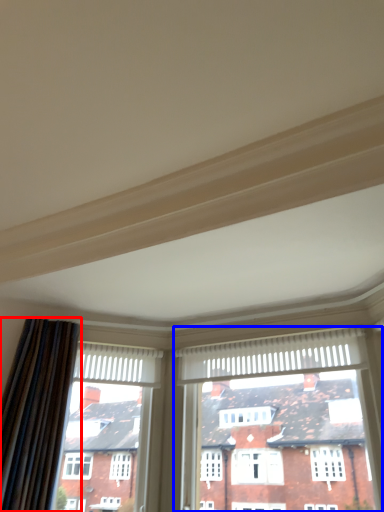
Question: Which object is further to the camera taking this photo, curtain (highlighted by a red box) or window (highlighted by a blue box)?

Choices:
 (A) curtain
 (B) window

Answer: (B)